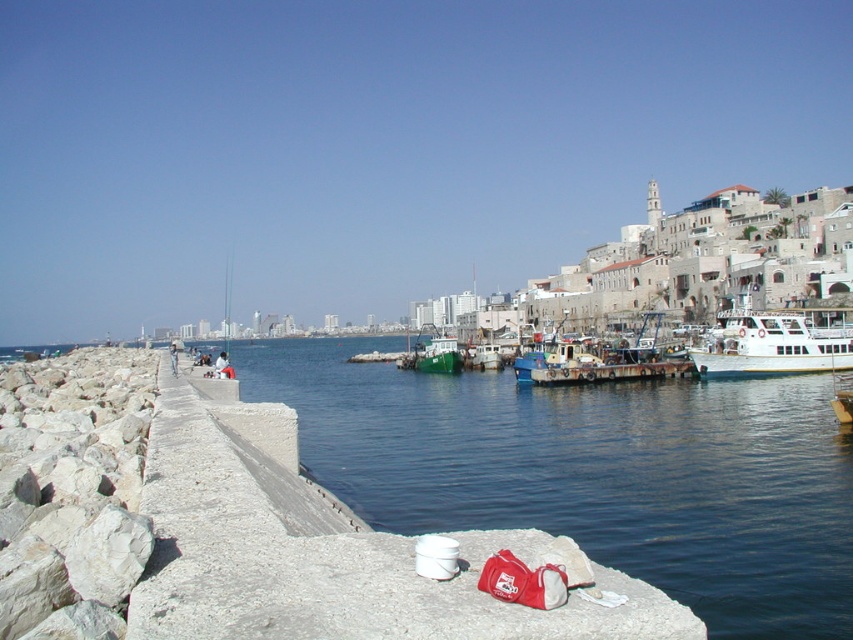
Question: Which of the following is the closest to the observer?

Choices:
 (A) concrete at left
 (B) white glossy boat at right
 (C) green matte boat at center

Answer: (A)

Question: Is concrete at left above white glossy boat at right?

Choices:
 (A) yes
 (B) no

Answer: (B)

Question: Observing the image, what is the correct spatial positioning of concrete at left in reference to white glossy boat at right?

Choices:
 (A) below
 (B) above

Answer: (A)

Question: Which point appears farthest from the camera in this image?

Choices:
 (A) (744, 317)
 (B) (413, 356)

Answer: (B)

Question: Is white glossy boat at right in front of green matte boat at center?

Choices:
 (A) yes
 (B) no

Answer: (A)

Question: Which is nearer to the green matte boat at center?

Choices:
 (A) concrete at left
 (B) white glossy boat at right

Answer: (A)